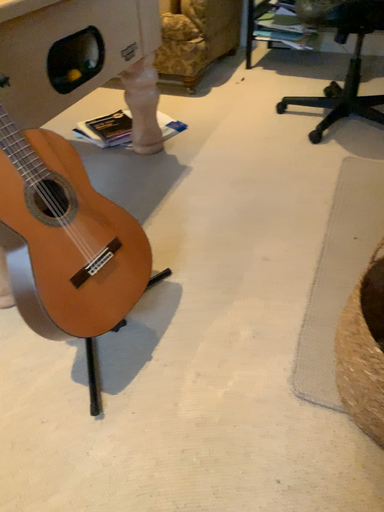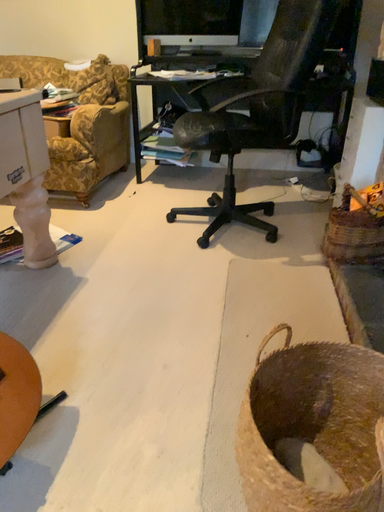
Question: Which way did the camera rotate in the video?

Choices:
 (A) rotated right
 (B) rotated left

Answer: (A)